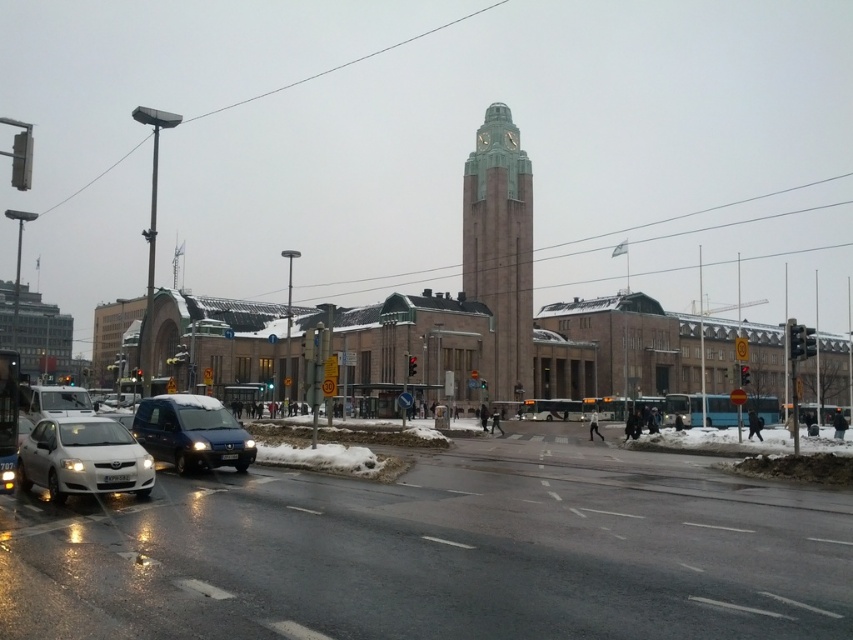
Question: Which point is closer to the camera?

Choices:
 (A) (531, 365)
 (B) (61, 499)

Answer: (B)

Question: Is green stone clock tower at center above white matte sedan at lower left?

Choices:
 (A) yes
 (B) no

Answer: (A)

Question: Is green stone clock tower at center above white matte sedan at lower left?

Choices:
 (A) yes
 (B) no

Answer: (A)

Question: Which point is farther to the camera?

Choices:
 (A) sleek metallic van at center
 (B) white matte sedan at lower left

Answer: (A)

Question: Can you confirm if green stone clock tower at center is positioned above white matte sedan at lower left?

Choices:
 (A) no
 (B) yes

Answer: (B)

Question: Considering the real-world distances, which object is farthest from the white matte sedan at lower left?

Choices:
 (A) green stone clock tower at center
 (B) sleek metallic van at center

Answer: (A)